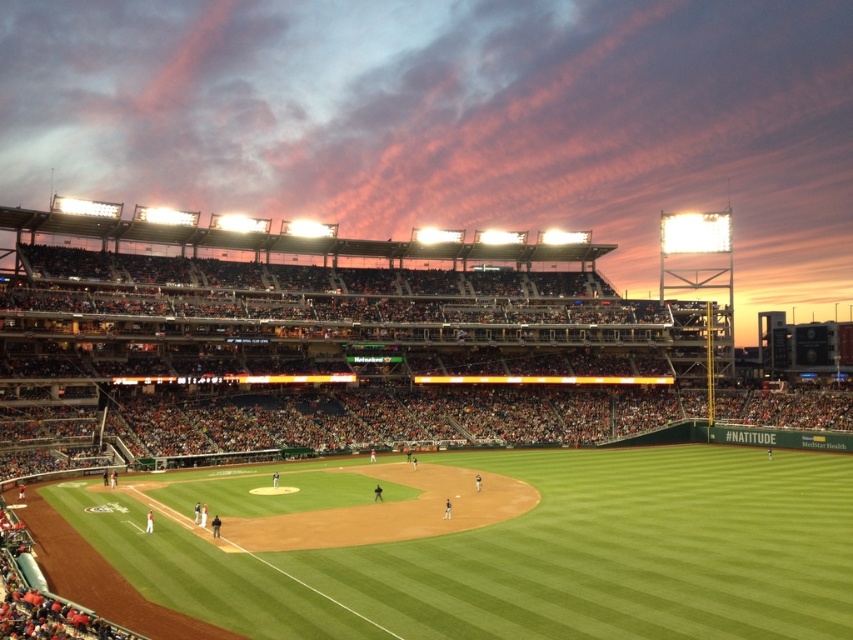
Question: Which object is closer to the camera taking this photo?

Choices:
 (A) green grass baseball stadium at center
 (B) green grass baseball field at center

Answer: (B)

Question: Does green grass baseball stadium at center have a lesser width compared to green grass baseball field at center?

Choices:
 (A) no
 (B) yes

Answer: (A)

Question: Can you confirm if green grass baseball stadium at center is positioned above green grass baseball field at center?

Choices:
 (A) yes
 (B) no

Answer: (A)

Question: Which point is farther to the camera?

Choices:
 (A) (737, 428)
 (B) (843, 518)

Answer: (A)

Question: Is green grass baseball stadium at center smaller than green grass baseball field at center?

Choices:
 (A) no
 (B) yes

Answer: (A)